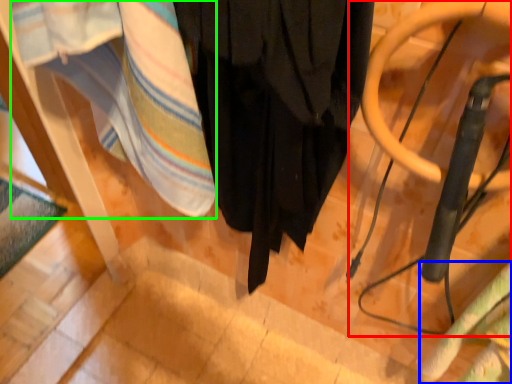
Question: Which is farther away from swivel chair (highlighted by a red box)? blanket (highlighted by a blue box) or blanket (highlighted by a green box)?

Choices:
 (A) blanket
 (B) blanket

Answer: (B)